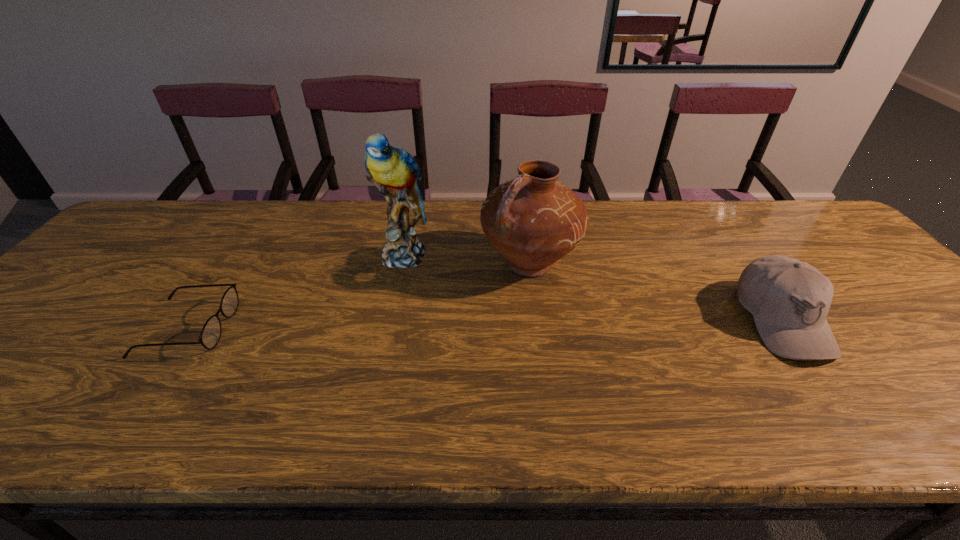
Where is `vacant region located 0.310m on the side of the pottery with the handle`? vacant region located 0.310m on the side of the pottery with the handle is located at coordinates (392, 346).

At what (x,y) coordinates should I click in order to perform the action: click on free space located on the side of the pottery with the handle. Please return your answer as a coordinate pair (x, y). The height and width of the screenshot is (540, 960). Looking at the image, I should click on (403, 339).

The height and width of the screenshot is (540, 960). Identify the location of free space located 0.130m on the face of the second object from left to right. (402, 309).

You are a GUI agent. You are given a task and a screenshot of the screen. Output one action in this format:
    pyautogui.click(x=<x>, y=<y>)
    Task: Click on the vacant space located 0.130m on the face of the second object from left to right
    This screenshot has width=960, height=540.
    Given the screenshot: What is the action you would take?
    pyautogui.click(x=402, y=309)

You are a GUI agent. You are given a task and a screenshot of the screen. Output one action in this format:
    pyautogui.click(x=<x>, y=<y>)
    Task: Click on the free space located on the face of the second object from left to right
    This screenshot has height=540, width=960.
    Given the screenshot: What is the action you would take?
    tap(403, 364)

Where is `pottery located at the far edge`? This screenshot has width=960, height=540. pottery located at the far edge is located at coordinates (533, 220).

Identify the location of parrot present at the far edge. (394, 171).

Find the location of a particular element. object located at the near edge is located at coordinates (789, 299).

Where is `vacant space at the far edge of the desktop`? The width and height of the screenshot is (960, 540). vacant space at the far edge of the desktop is located at coordinates (682, 218).

Where is `vacant space at the near edge of the desktop`? The height and width of the screenshot is (540, 960). vacant space at the near edge of the desktop is located at coordinates (858, 371).